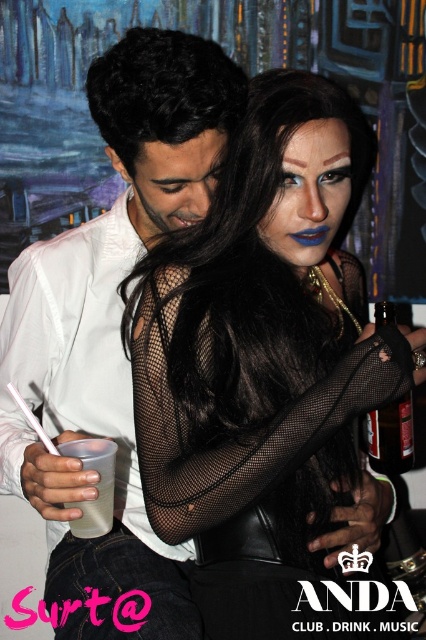
Question: Does black fishnet gloves at center have a larger size compared to translucent plastic cup at lower left?

Choices:
 (A) no
 (B) yes

Answer: (B)

Question: Can you confirm if white matte shirt at center is positioned below translucent plastic cup at lower left?

Choices:
 (A) yes
 (B) no

Answer: (B)

Question: Can you confirm if white matte shirt at center is thinner than translucent plastic cup at lower left?

Choices:
 (A) yes
 (B) no

Answer: (B)

Question: Which point is farther to the camera?

Choices:
 (A) white matte shirt at center
 (B) translucent plastic cup at lower left

Answer: (B)

Question: Which object is the closest to the black fishnet gloves at center?

Choices:
 (A) translucent plastic cup at lower left
 (B) brown glass bottle at center right

Answer: (B)

Question: Which of the following is the farthest from the observer?

Choices:
 (A) black fishnet gloves at center
 (B) white matte shirt at center
 (C) brown glass bottle at center right

Answer: (C)